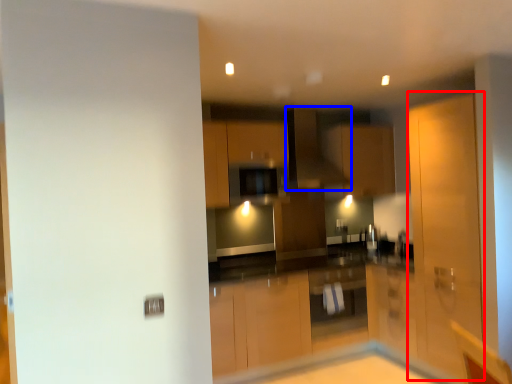
Question: Which object appears closest to the camera in this image, screen door (highlighted by a red box) or exhaust hood (highlighted by a blue box)?

Choices:
 (A) screen door
 (B) exhaust hood

Answer: (A)